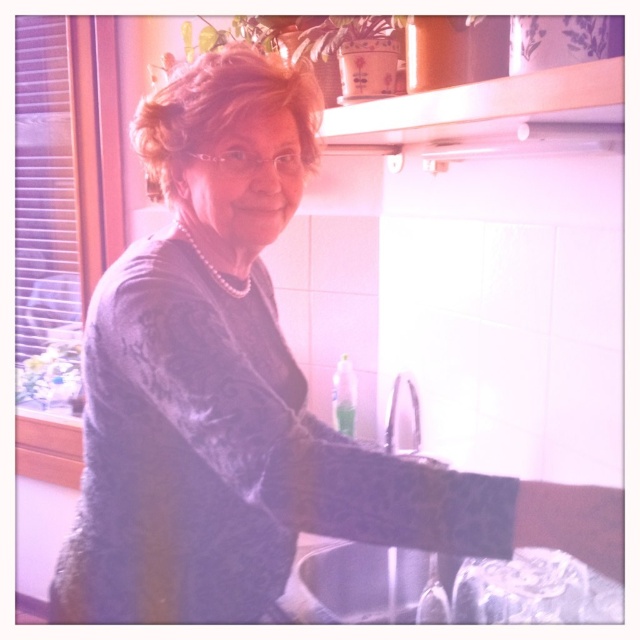
You are a delivery person who just arrived at a house. You see a person wearing a matte gray sweater at center and a black matte sink at lower center. Which object is taller?

The matte gray sweater at center is much taller than the black matte sink at lower center.

You are taking a photo of the kitchen scene. You notice two points in the image at coordinates point (x=413, y=400) and point (x=385, y=444). Which point is closer to the camera?

Point (x=413, y=400) is further to the camera than point (x=385, y=444), so point (x=385, y=444) is closer to the camera.

You are a delivery robot that is 18 inches wide. You want to move from the entrance to the kitchen counter where there is a glass. Is there enough space between the matte gray sweater at center and the black matte sink at lower center for you to pass through?

The matte gray sweater at center and the black matte sink at lower center are 17.92 inches apart. Since the robot is 18 inches wide, there is not enough space for it to pass through the gap between them.